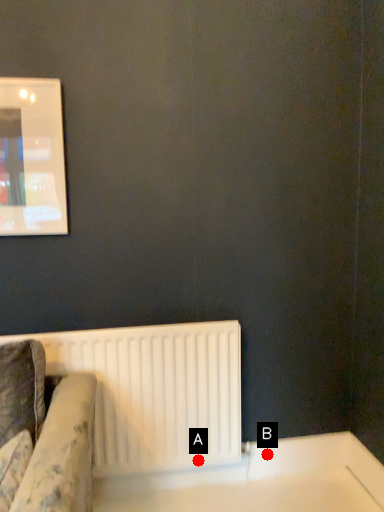
Question: Two points are circled on the image, labeled by A and B beside each circle. Which point is farther from the camera taking this photo?

Choices:
 (A) A is further
 (B) B is further

Answer: (B)